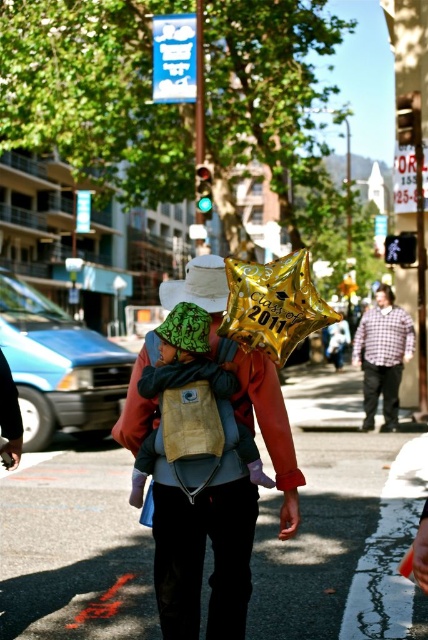
Question: Is green fabric baby at center wider than plaid shirt at center?

Choices:
 (A) no
 (B) yes

Answer: (A)

Question: Which of the following is the farthest from the observer?

Choices:
 (A) gold metallic balloon at upper center
 (B) green fabric baby at center
 (C) plaid shirt at center

Answer: (C)

Question: Does green fabric baby at center have a greater width compared to gold metallic balloon at center?

Choices:
 (A) no
 (B) yes

Answer: (B)

Question: Estimate the real-world distances between objects in this image. Which object is closer to the green fabric baby at center?

Choices:
 (A) matte plaid shirt at center
 (B) plaid shirt at center

Answer: (B)

Question: Which of the following is the farthest from the observer?

Choices:
 (A) green fabric baby at center
 (B) plaid shirt at center

Answer: (B)

Question: Is gold metallic balloon at upper center bigger than green fabric baby at center?

Choices:
 (A) no
 (B) yes

Answer: (B)